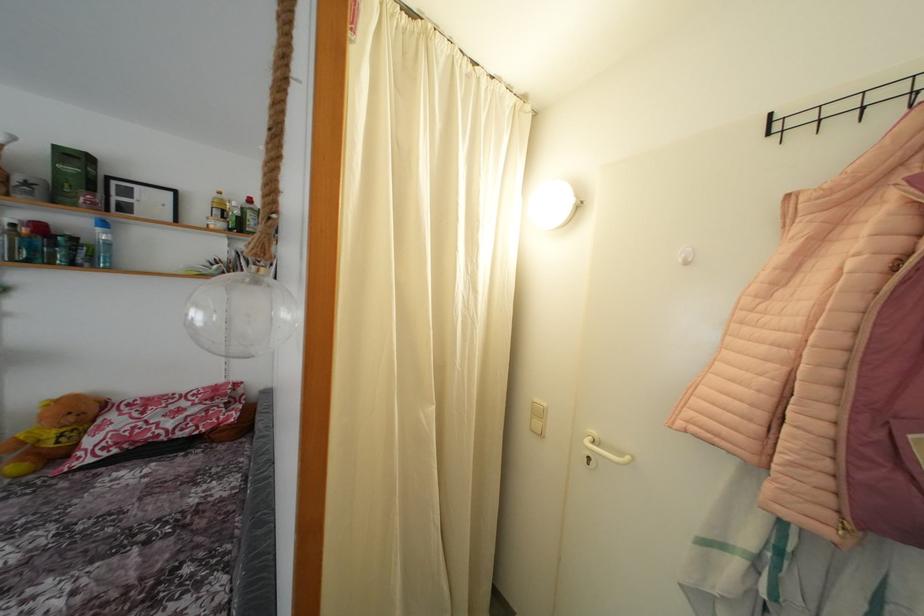
Where is `door keyhole`? This screenshot has width=924, height=616. door keyhole is located at coordinates (590, 460).